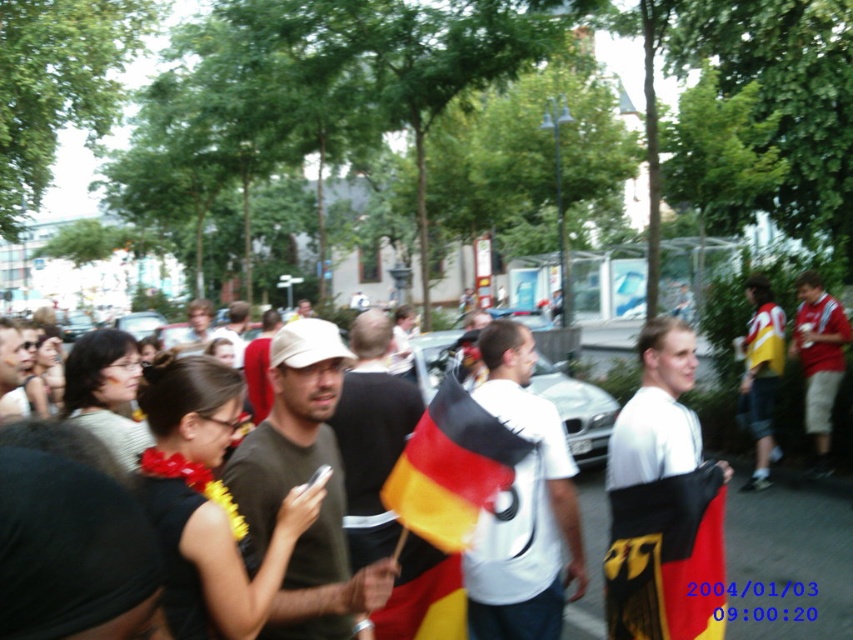
Which of these two, white jersey at center or red cotton shirt at center, stands taller?

red cotton shirt at center

Between white jersey at center and red cotton shirt at center, which one appears on the left side from the viewer's perspective?

white jersey at center

Is point (521, 632) behind point (827, 349)?

No, (521, 632) is closer to viewer.

The width and height of the screenshot is (853, 640). Find the location of `white jersey at center`. white jersey at center is located at coordinates (523, 506).

Who is positioned more to the right, german flag at center or matte black shirt at center?

german flag at center

Which is behind, point (828, 536) or point (344, 456)?

The point (828, 536) is behind.

Describe the element at coordinates (790, 560) in the screenshot. The width and height of the screenshot is (853, 640). I see `german flag at center` at that location.

Image resolution: width=853 pixels, height=640 pixels. Identify the location of german flag at center. (790, 560).

Between polyester flag at center and yellow jersey at right, which one appears on the right side from the viewer's perspective?

Positioned to the right is yellow jersey at right.

Looking at this image, which is more to the left, polyester flag at center or yellow jersey at right?

Positioned to the left is polyester flag at center.

Is point (459, 400) positioned behind point (763, 284)?

That is False.

Where is `polyester flag at center`? This screenshot has height=640, width=853. polyester flag at center is located at coordinates (451, 468).